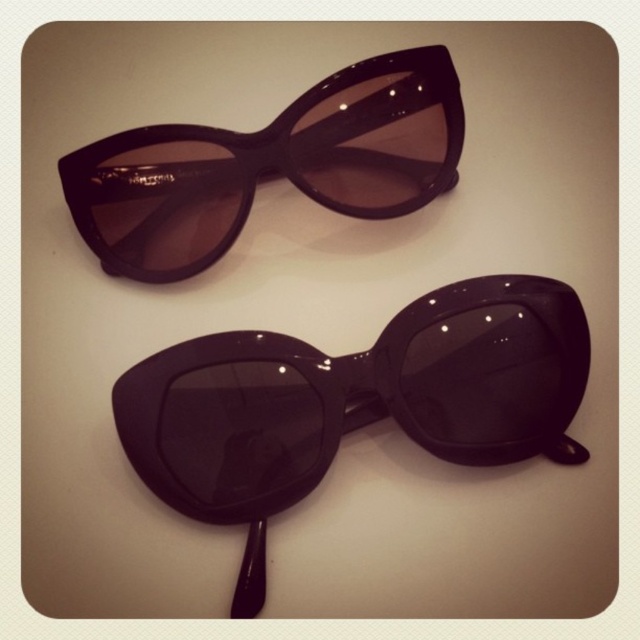
Question: Is glossy black sunglasses at center above glossy black sunglasses at upper center?

Choices:
 (A) yes
 (B) no

Answer: (B)

Question: Can you confirm if glossy black sunglasses at center is positioned above glossy black sunglasses at upper center?

Choices:
 (A) yes
 (B) no

Answer: (B)

Question: Which of the following is the farthest from the observer?

Choices:
 (A) (x=432, y=298)
 (B) (x=352, y=113)

Answer: (B)

Question: Which point appears farthest from the camera in this image?

Choices:
 (A) (428, 445)
 (B) (429, 60)

Answer: (A)

Question: Is glossy black sunglasses at center to the left of glossy black sunglasses at upper center from the viewer's perspective?

Choices:
 (A) yes
 (B) no

Answer: (B)